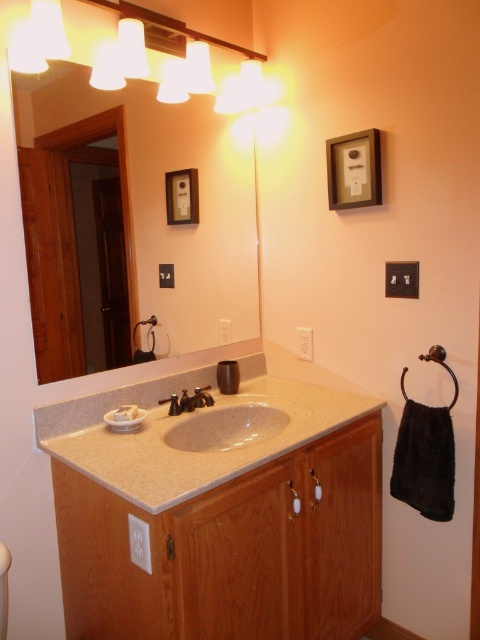
Question: Which object is positioned farthest from the matte plastic picture frame at upper center?

Choices:
 (A) wooden picture frame at upper center
 (B) beige granite sink at center

Answer: (B)

Question: Estimate the real-world distances between objects in this image. Which object is closer to the satin nickel faucet at sink center?

Choices:
 (A) beige marble sink at center
 (B) white glossy mirror at upper center

Answer: (A)

Question: Can you confirm if beige granite sink at center is positioned to the right of matte plastic picture frame at upper center?

Choices:
 (A) no
 (B) yes

Answer: (B)

Question: Which point is farther to the camera?

Choices:
 (A) (27, 218)
 (B) (201, 401)

Answer: (B)

Question: Is beige granite sink at center below beige marble sink at center?

Choices:
 (A) no
 (B) yes

Answer: (A)

Question: Does white glossy mirror at upper center have a greater width compared to beige marble sink at center?

Choices:
 (A) yes
 (B) no

Answer: (A)